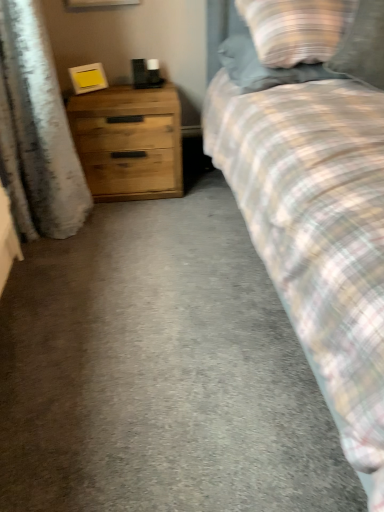
Question: Is wooden chest of drawers at left at the left side of plaid fabric pillow at upper right, which is the second pillow in left-to-right order?

Choices:
 (A) no
 (B) yes

Answer: (B)

Question: Is plaid fabric pillow at upper right, the first pillow from the right, at the back of wooden chest of drawers at left?

Choices:
 (A) yes
 (B) no

Answer: (B)

Question: Would you consider wooden chest of drawers at left to be distant from plaid fabric pillow at upper right, the first pillow from the right?

Choices:
 (A) yes
 (B) no

Answer: (B)

Question: Does wooden chest of drawers at left turn towards plaid fabric pillow at upper right, which is the second pillow in left-to-right order?

Choices:
 (A) no
 (B) yes

Answer: (A)

Question: From the image's perspective, does wooden chest of drawers at left appear higher than plaid fabric pillow at upper right, the first pillow from the right?

Choices:
 (A) yes
 (B) no

Answer: (B)

Question: From a real-world perspective, is plaid fabric pillow at upper right, the first pillow from the right, above or below wooden chest of drawers at left?

Choices:
 (A) above
 (B) below

Answer: (A)

Question: In terms of size, does plaid fabric pillow at upper right, which is the second pillow in left-to-right order, appear bigger or smaller than wooden chest of drawers at left?

Choices:
 (A) big
 (B) small

Answer: (B)

Question: Is plaid fabric pillow at upper right, which is the second pillow in left-to-right order, taller or shorter than wooden chest of drawers at left?

Choices:
 (A) tall
 (B) short

Answer: (B)

Question: Considering the positions of plaid fabric pillow at upper right, the first pillow from the right, and wooden chest of drawers at left in the image, is plaid fabric pillow at upper right, the first pillow from the right, wider or thinner than wooden chest of drawers at left?

Choices:
 (A) thin
 (B) wide

Answer: (A)

Question: Relative to plaid fabric pillow at upper right, acting as the second pillow starting from the right, is wooden chest of drawers at left in front or behind?

Choices:
 (A) behind
 (B) front

Answer: (A)

Question: From a real-world perspective, is wooden chest of drawers at left physically located above or below plaid fabric pillow at upper right, acting as the second pillow starting from the right?

Choices:
 (A) below
 (B) above

Answer: (A)

Question: Is point (130, 118) positioned closer to the camera than point (332, 50)?

Choices:
 (A) farther
 (B) closer

Answer: (A)

Question: Considering the relative positions of wooden chest of drawers at left and plaid fabric pillow at upper right, marked as the first pillow in a left-to-right arrangement, in the image provided, is wooden chest of drawers at left to the left or to the right of plaid fabric pillow at upper right, marked as the first pillow in a left-to-right arrangement,?

Choices:
 (A) left
 (B) right

Answer: (A)

Question: In terms of height, does plaid fabric pillow at upper right, marked as the first pillow in a left-to-right arrangement, look taller or shorter compared to wooden chest of drawers at left?

Choices:
 (A) tall
 (B) short

Answer: (B)

Question: Which is correct: plaid fabric pillow at upper right, acting as the second pillow starting from the right, is inside wooden chest of drawers at left, or outside of it?

Choices:
 (A) inside
 (B) outside

Answer: (B)